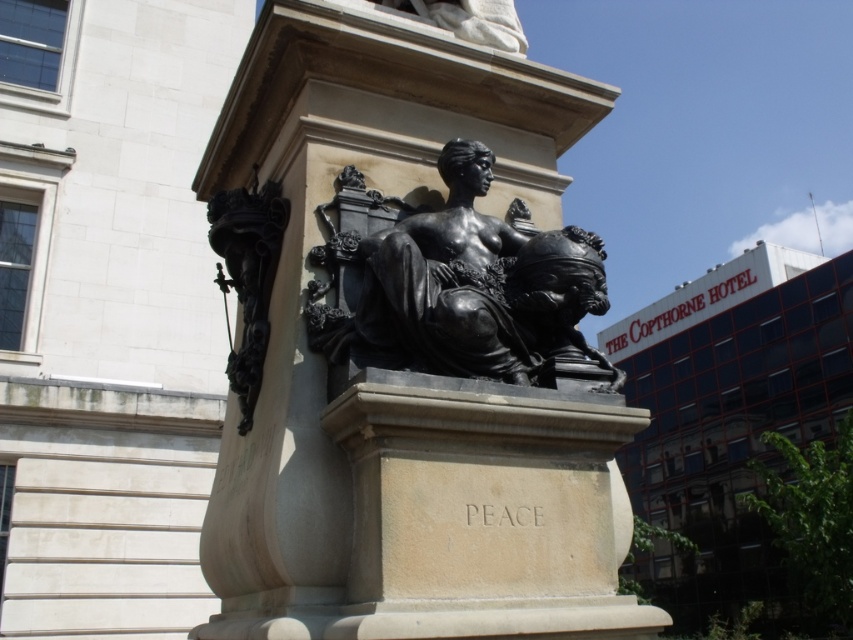
You are a photographer standing at the camera position. You want to capture the bronze statue at center in a closeup shot. If your camera can focus on subjects within 5 meters, will you be able to take the photo without moving closer?

The distance between the bronze statue at center and the camera is 5.18 meters, which is beyond the camera focus range of 5 meters. Therefore, you cannot take the closeup shot without moving closer.